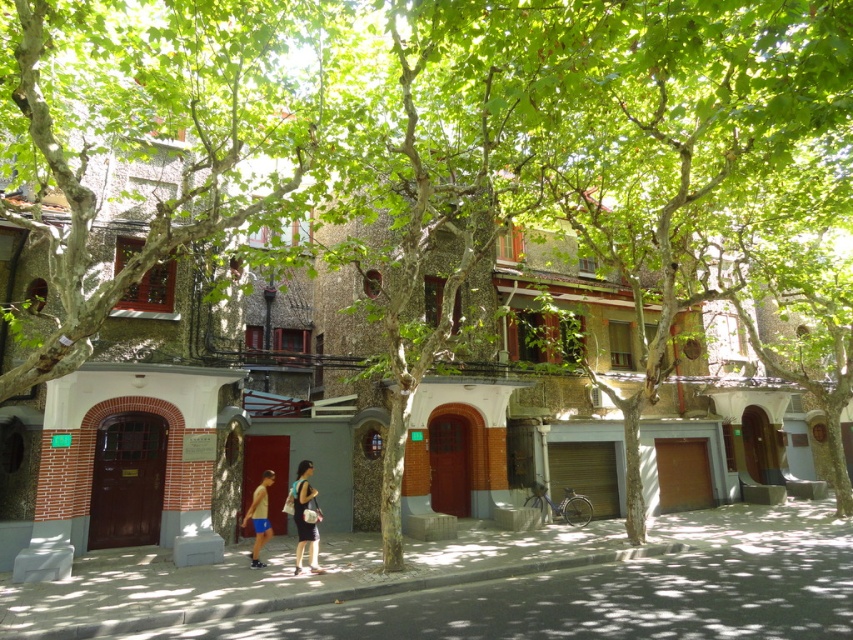
You are a fashion designer observing the urban street scene. You notice two items of clothing at the center of the image. Which clothing item is closer to you, the matte black shorts at center or the matte black dress at center?

The matte black shorts at center are closer to you because the matte black dress at center is positioned behind them.

You are a photographer standing in the middle of the urban street scene. You see a matte black shorts at center and a tan skin man at center. Which object is taller? Please answer based on their height.

The matte black shorts at center is much taller than the tan skin man at center.